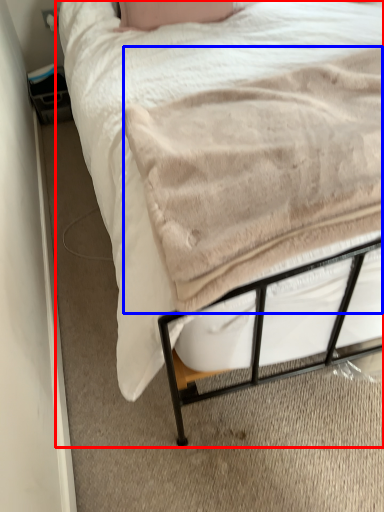
Question: Which of the following is the farthest to the observer, bed (highlighted by a red box) or blanket (highlighted by a blue box)?

Choices:
 (A) bed
 (B) blanket

Answer: (A)